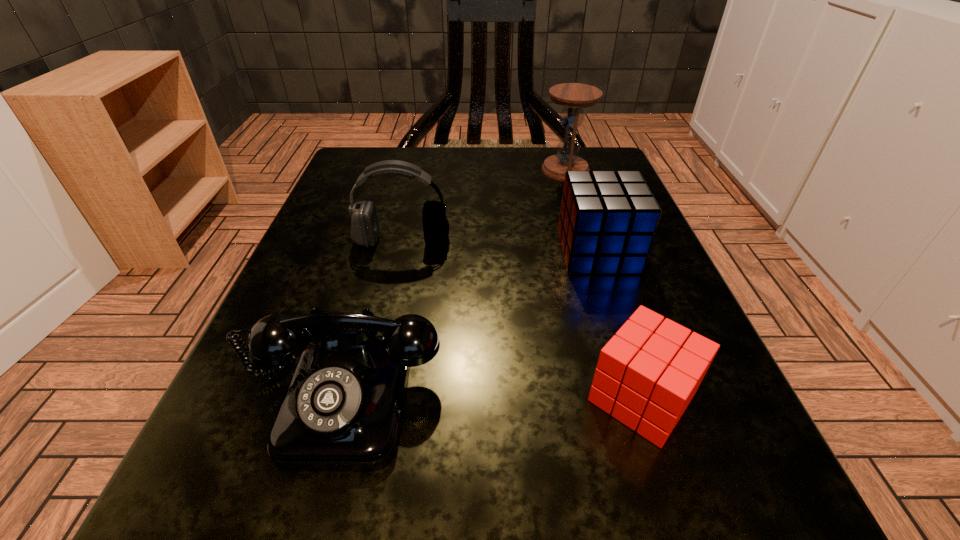
In the image, there is a desktop. Where is `free space at the right edge`? free space at the right edge is located at coordinates (676, 316).

Image resolution: width=960 pixels, height=540 pixels. What are the coordinates of `vacant space at the far right corner` in the screenshot? It's located at (598, 154).

In order to click on unoccupied position between the shorter cube and the headset in this screenshot , I will do `click(521, 319)`.

Identify the location of free space between the headset and the taller cube. (500, 246).

Where is `vacant space that is in between the farthest object and the shorter cube`? The height and width of the screenshot is (540, 960). vacant space that is in between the farthest object and the shorter cube is located at coordinates (603, 284).

In order to click on free space between the shortest object and the telephone in this screenshot , I will do `click(492, 395)`.

Find the location of a particular element. This screenshot has height=540, width=960. vacant area that lies between the headset and the taller cube is located at coordinates (500, 246).

Find the location of a particular element. The width and height of the screenshot is (960, 540). empty space that is in between the taller cube and the shorter cube is located at coordinates pyautogui.click(x=619, y=325).

Locate an element on the screen. This screenshot has width=960, height=540. vacant space that's between the hourglass and the shortest object is located at coordinates pos(603,284).

In order to click on free spot between the shorter cube and the headset in this screenshot , I will do `click(521, 319)`.